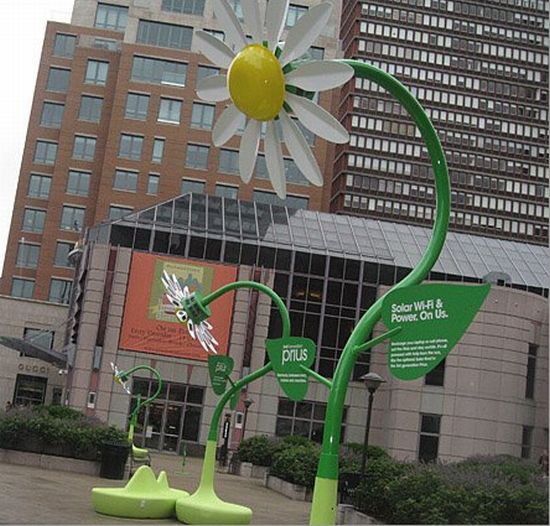
The width and height of the screenshot is (550, 526). I want to click on bench, so click(x=137, y=458), click(x=134, y=497), click(x=200, y=510).